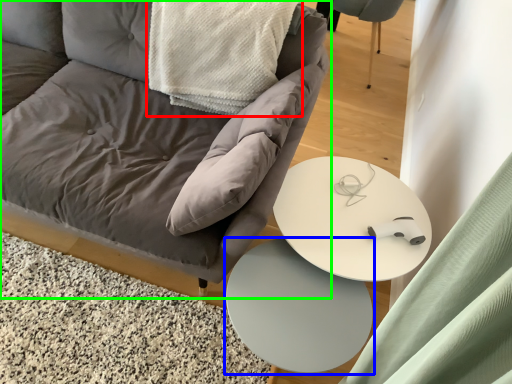
Question: Which is farther away from material (highlighted by a red box)? table (highlighted by a blue box) or chair (highlighted by a green box)?

Choices:
 (A) table
 (B) chair

Answer: (A)